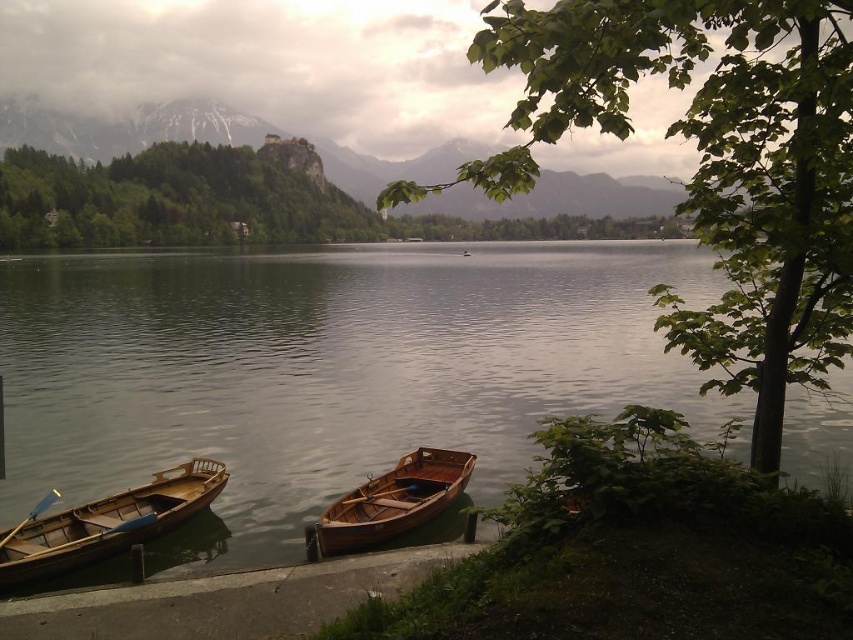
You are standing at the edge of the lake and want to take a photo of the two points marked in the scene. Which point, point (704, 179) or point (373, 493), will appear larger in your photo?

Point (704, 179) will appear larger in the photo because it is closer to the camera than point (373, 493).

You are planning to take a photo of the wooden canoe at lower left and the smooth water at center. Which object should you focus on first if you want to capture both in a single shot without moving the camera?

The smooth water at center has a larger size compared to wooden canoe at lower left, so you should focus on the smooth water at center first to ensure it fills the frame appropriately before adjusting for the smaller wooden canoe at lower left.

You are standing at the center of the image. Which direction should you move to reach the wooden dock at lower left?

Since the wooden dock at lower left is located at point (227, 600) in 2D coordinates, you should move towards the lower left direction to reach it.